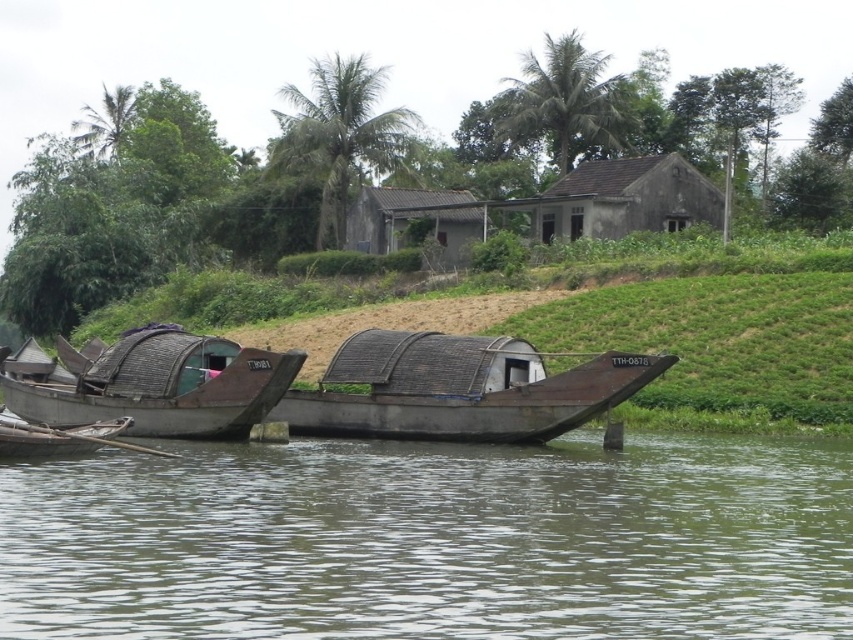
Between gray corrugated metal hut at center and rusty metal canoe at lower left, which one appears on the left side from the viewer's perspective?

Positioned to the left is rusty metal canoe at lower left.

Can you confirm if gray corrugated metal hut at center is shorter than rusty metal canoe at lower left?

No, gray corrugated metal hut at center is not shorter than rusty metal canoe at lower left.

Find the location of a particular element. The width and height of the screenshot is (853, 640). gray corrugated metal hut at center is located at coordinates (413, 220).

Is point (637, 620) positioned in front of point (103, 433)?

That is True.

Who is shorter, brown matte water at center or rusty metal canoe at lower left?

rusty metal canoe at lower left

Who is more distant from viewer, [144,500] or [90,449]?

Point [90,449]

This screenshot has height=640, width=853. I want to click on brown matte water at center, so click(x=433, y=540).

Is brown matte water at center above rusty metal boat at left?

Actually, brown matte water at center is below rusty metal boat at left.

Is the position of brown matte water at center more distant than that of rusty metal boat at left?

No.

Where is `brown matte water at center`? brown matte water at center is located at coordinates tap(433, 540).